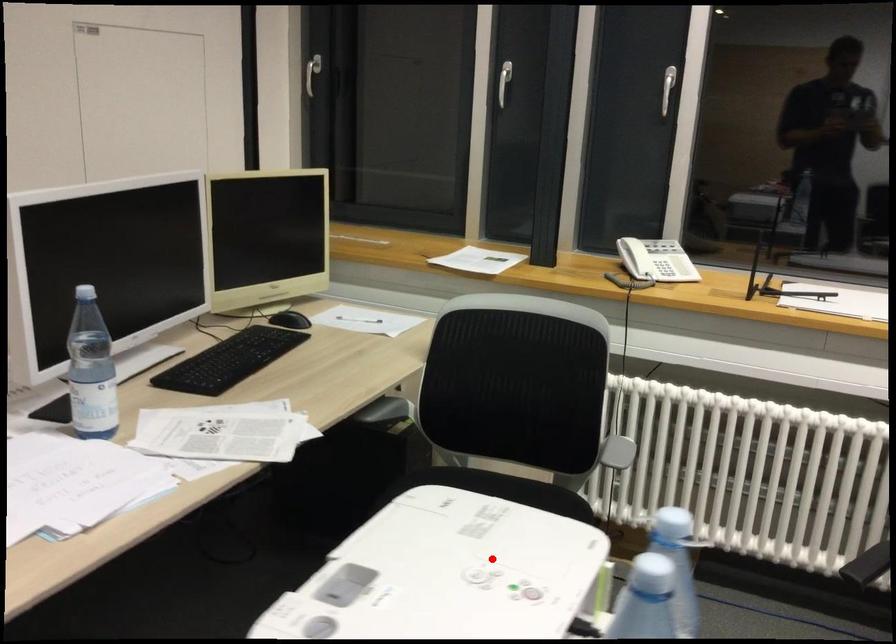
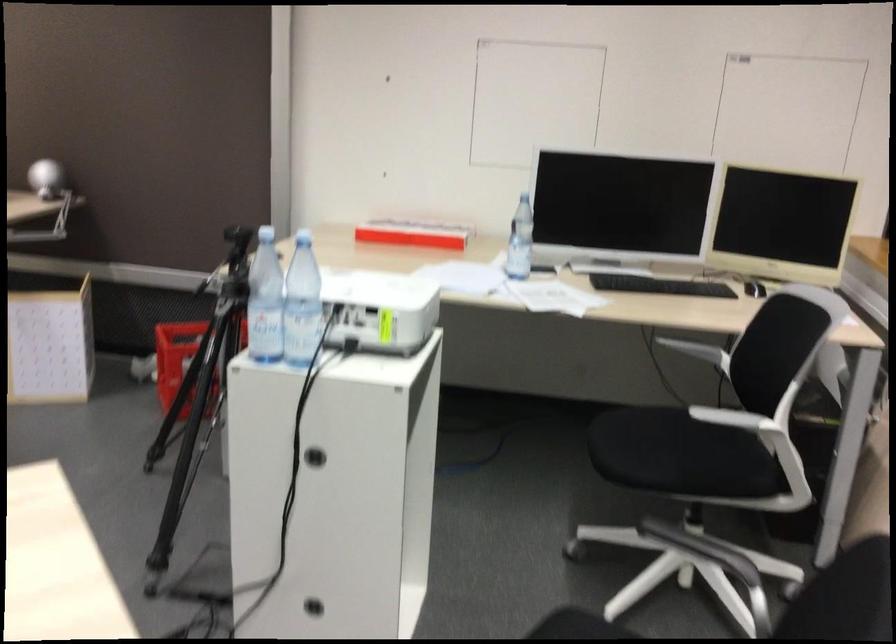
Where in the second image is the point corresponding to the highlighted location from the first image?

(380, 308)